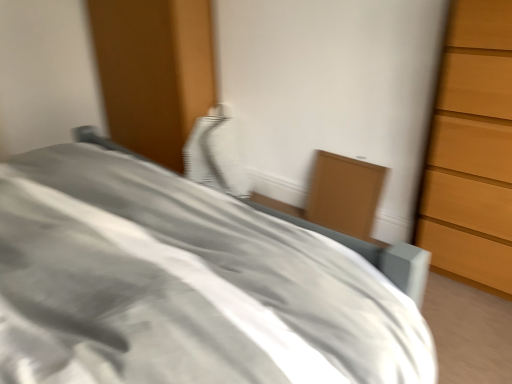
Describe the element at coordinates (183, 285) in the screenshot. Image resolution: width=512 pixels, height=384 pixels. I see `gray fabric bed at center` at that location.

The height and width of the screenshot is (384, 512). Find the location of `matte wood cabinet at center-right`. matte wood cabinet at center-right is located at coordinates (344, 194).

Image resolution: width=512 pixels, height=384 pixels. Identify the location of white textured pillow at center. (216, 156).

From the image's perspective, is gray fabric bed at center located beneath white textured pillow at center?

Indeed, from the image's perspective, gray fabric bed at center is shown beneath white textured pillow at center.

Does gray fabric bed at center have a greater width compared to white textured pillow at center?

Correct, the width of gray fabric bed at center exceeds that of white textured pillow at center.

Is point (150, 312) farther from camera compared to point (187, 173)?

No, it is in front of (187, 173).

In the scene shown: Is gray fabric bed at center next to white textured pillow at center?

No, gray fabric bed at center is not touching white textured pillow at center.

What's the angular difference between white textured pillow at center and gray fabric bed at center's facing directions?

The angular difference between white textured pillow at center and gray fabric bed at center is 179 degrees.

From a real-world perspective, which is physically below, white textured pillow at center or gray fabric bed at center?

white textured pillow at center, from a real-world perspective.

Is point (222, 129) closer to viewer compared to point (248, 346)?

No, it is not.

Is white textured pillow at center oriented towards gray fabric bed at center?

No, white textured pillow at center does not turn towards gray fabric bed at center.

Considering the relative positions of matte wood cabinet at center-right and white textured pillow at center in the image provided, is matte wood cabinet at center-right to the right of white textured pillow at center from the viewer's perspective?

Yes.

In the image, is matte wood cabinet at center-right positioned in front of or behind white textured pillow at center?

Clearly, matte wood cabinet at center-right is in front of white textured pillow at center.

From a real-world perspective, relative to white textured pillow at center, is matte wood cabinet at center-right vertically above or below?

In terms of real-world spatial position, matte wood cabinet at center-right is below white textured pillow at center.

Does matte wood cabinet at center-right have a lesser height compared to white textured pillow at center?

Yes.

How many degrees apart are the facing directions of matte wood cabinet at center-right and gray fabric bed at center?

There is a 179-degree angle between the facing directions of matte wood cabinet at center-right and gray fabric bed at center.

Where is `cabinetry below the gray fabric bed at center (from a real-world perspective)`? cabinetry below the gray fabric bed at center (from a real-world perspective) is located at coordinates (344, 194).

Which point is more distant from viewer, (377, 172) or (289, 265)?

Point (377, 172)

Is gray fabric bed at center at the back of matte wood cabinet at center-right?

No.

Is white textured pillow at center positioned before matte wood cabinet at center-right?

No, the depth of white textured pillow at center is greater than that of matte wood cabinet at center-right.

Between white textured pillow at center and matte wood cabinet at center-right, which one has less height?

matte wood cabinet at center-right is shorter.

Is white textured pillow at center wider or thinner than matte wood cabinet at center-right?

In the image, white textured pillow at center appears to be wider than matte wood cabinet at center-right.

From the image's perspective, would you say white textured pillow at center is positioned over matte wood cabinet at center-right?

Correct, white textured pillow at center appears higher than matte wood cabinet at center-right in the image.

Is gray fabric bed at center not inside matte wood cabinet at center-right?

Yes.

Is matte wood cabinet at center-right at the back of gray fabric bed at center?

gray fabric bed at center is not turned away from matte wood cabinet at center-right.

Is point (111, 288) positioned in front of point (323, 207)?

Yes, point (111, 288) is in front of point (323, 207).

From the image's perspective, is gray fabric bed at center located above or below matte wood cabinet at center-right?

gray fabric bed at center is below matte wood cabinet at center-right.

This screenshot has height=384, width=512. In order to click on pillow above the gray fabric bed at center (from the image's perspective) in this screenshot , I will do `click(216, 156)`.

Find the location of a particular element. The image size is (512, 384). pillow on the right of the gray fabric bed at center is located at coordinates (216, 156).

Looking at the image, which one is located closer to white textured pillow at center, matte wood cabinet at center-right or gray fabric bed at center?

The object closer to white textured pillow at center is matte wood cabinet at center-right.

From the image, which object appears to be nearer to matte wood cabinet at center-right, white textured pillow at center or gray fabric bed at center?

Based on the image, white textured pillow at center appears to be nearer to matte wood cabinet at center-right.

Based on their spatial positions, is white textured pillow at center or matte wood cabinet at center-right further from gray fabric bed at center?

white textured pillow at center.

When comparing their distances from gray fabric bed at center, does matte wood cabinet at center-right or white textured pillow at center seem further?

white textured pillow at center lies further to gray fabric bed at center than the other object.

Estimate the real-world distances between objects in this image. Which object is further from white textured pillow at center, gray fabric bed at center or matte wood cabinet at center-right?

Among the two, gray fabric bed at center is located further to white textured pillow at center.

When comparing their distances from matte wood cabinet at center-right, does gray fabric bed at center or white textured pillow at center seem closer?

white textured pillow at center is closer to matte wood cabinet at center-right.

The image size is (512, 384). I want to click on cabinetry between gray fabric bed at center and white textured pillow at center along the z-axis, so click(x=344, y=194).